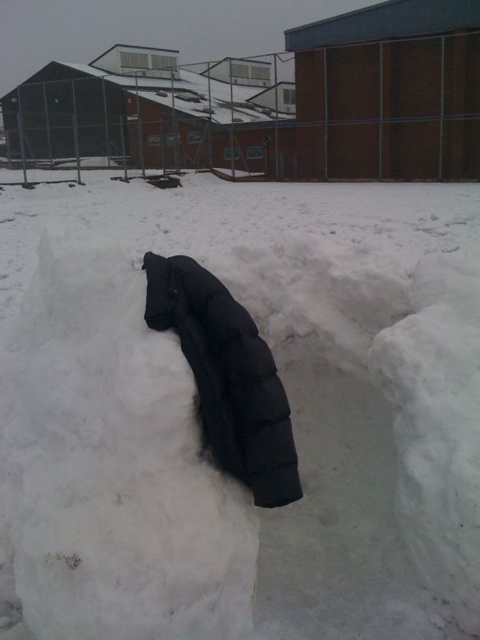
Is point (347, 397) closer to viewer compared to point (215, 452)?

No, (347, 397) is behind (215, 452).

Does white fluffy snow at center have a lesser width compared to black down jacket at center?

No.

I want to click on white fluffy snow at center, so 195,426.

I want to click on white fluffy snow at center, so click(x=195, y=426).